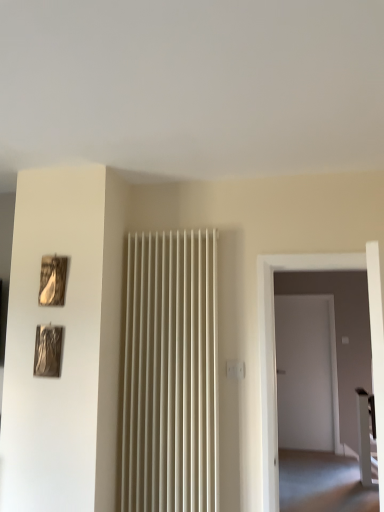
Question: From a real-world perspective, is wooden matte picture frame at upper left, positioned as the 2th picture frame in bottom-to-top order, positioned above or below metallic silver picture frame at left, which is counted as the 1th picture frame, starting from the bottom?

Choices:
 (A) above
 (B) below

Answer: (A)

Question: Considering the relative positions of wooden matte picture frame at upper left, which is the first picture frame from top to bottom, and metallic silver picture frame at left, marked as the second picture frame in a top-to-bottom arrangement, in the image provided, is wooden matte picture frame at upper left, which is the first picture frame from top to bottom, to the left or to the right of metallic silver picture frame at left, marked as the second picture frame in a top-to-bottom arrangement,?

Choices:
 (A) left
 (B) right

Answer: (B)

Question: Which object is positioned closest to the white glossy table at right?

Choices:
 (A) wooden matte picture frame at upper left, which is the first picture frame from top to bottom
 (B) metallic silver picture frame at left, marked as the second picture frame in a top-to-bottom arrangement

Answer: (B)

Question: Which object is positioned closest to the white glossy table at right?

Choices:
 (A) metallic silver picture frame at left, marked as the second picture frame in a top-to-bottom arrangement
 (B) wooden matte picture frame at upper left, which is the first picture frame from top to bottom

Answer: (A)